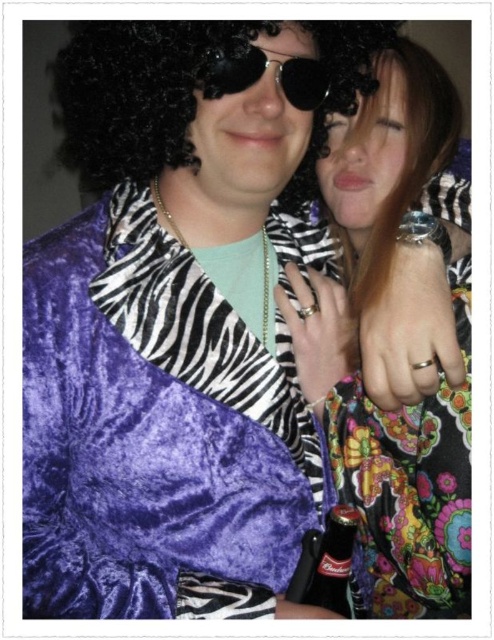
Who is more forward, (441, 122) or (325, 608)?

Positioned in front is point (325, 608).

From the picture: Who is higher up, floral-patterned fabric at upper right or black glass bottle at center?

floral-patterned fabric at upper right

Locate an element on the screen. This screenshot has width=494, height=640. floral-patterned fabric at upper right is located at coordinates coord(396,339).

Which is behind, point (125, 493) or point (466, 275)?

The point (466, 275) is more distant.

Which is more to the left, purple velvet robe at left or floral-patterned fabric at upper right?

From the viewer's perspective, purple velvet robe at left appears more on the left side.

What do you see at coordinates (154, 432) in the screenshot? This screenshot has width=494, height=640. I see `purple velvet robe at left` at bounding box center [154, 432].

This screenshot has height=640, width=494. I want to click on purple velvet robe at left, so click(154, 432).

Can you confirm if purple velvet robe at left is positioned above black reflective sunglasses at center?

Actually, purple velvet robe at left is below black reflective sunglasses at center.

Is point (96, 476) positioned before point (310, 102)?

That is True.

Between point (256, 561) and point (327, 68), which one is positioned in front?

Point (256, 561) is more forward.

This screenshot has width=494, height=640. I want to click on purple velvet robe at left, so click(154, 432).